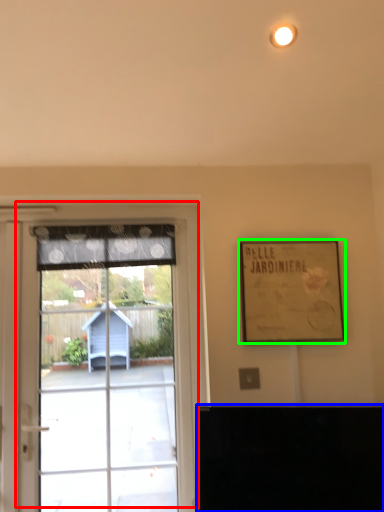
Question: Which object is positioned closest to window (highlighted by a red box)? Select from furniture (highlighted by a blue box) and picture frame (highlighted by a green box).

Choices:
 (A) furniture
 (B) picture frame

Answer: (B)